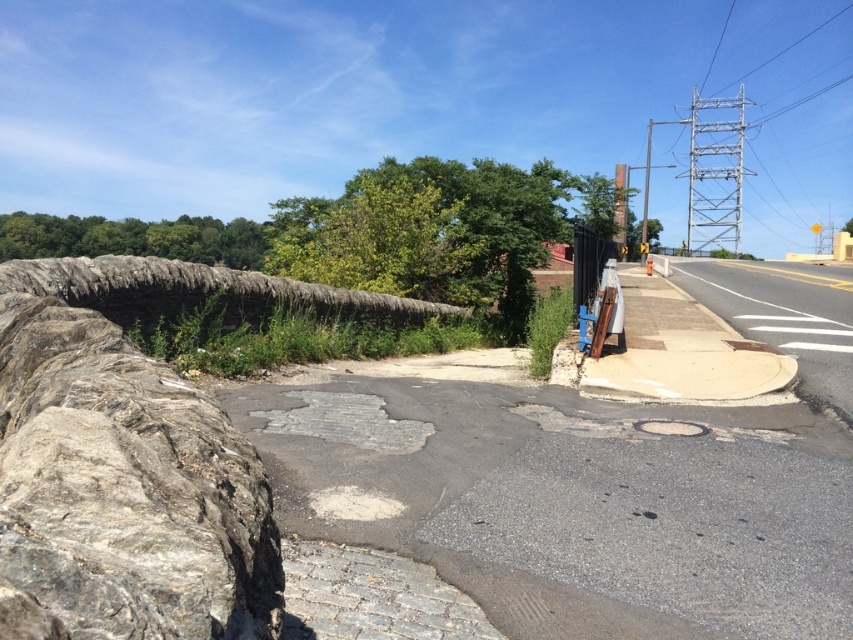
Which is below, gray rough stone at left or metallic gray pole at upper right?

Positioned lower is gray rough stone at left.

Which is behind, point (165, 516) or point (648, 180)?

The point (648, 180) is more distant.

Is point (76, 317) in front of point (647, 173)?

Yes, it is in front of point (647, 173).

Where is `gray rough stone at left`? This screenshot has height=640, width=853. gray rough stone at left is located at coordinates (122, 492).